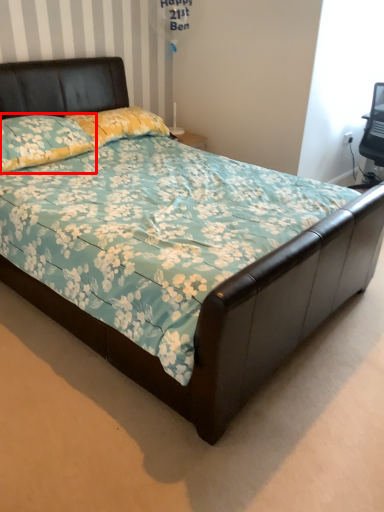
Question: From the image's perspective, where is pillow (annotated by the red box) located in relation to pillow in the image?

Choices:
 (A) below
 (B) above

Answer: (A)